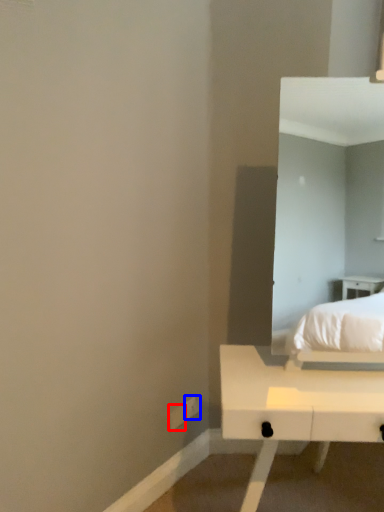
Question: Which object is closer to the camera taking this photo, electric outlet (highlighted by a red box) or electric outlet (highlighted by a blue box)?

Choices:
 (A) electric outlet
 (B) electric outlet

Answer: (A)